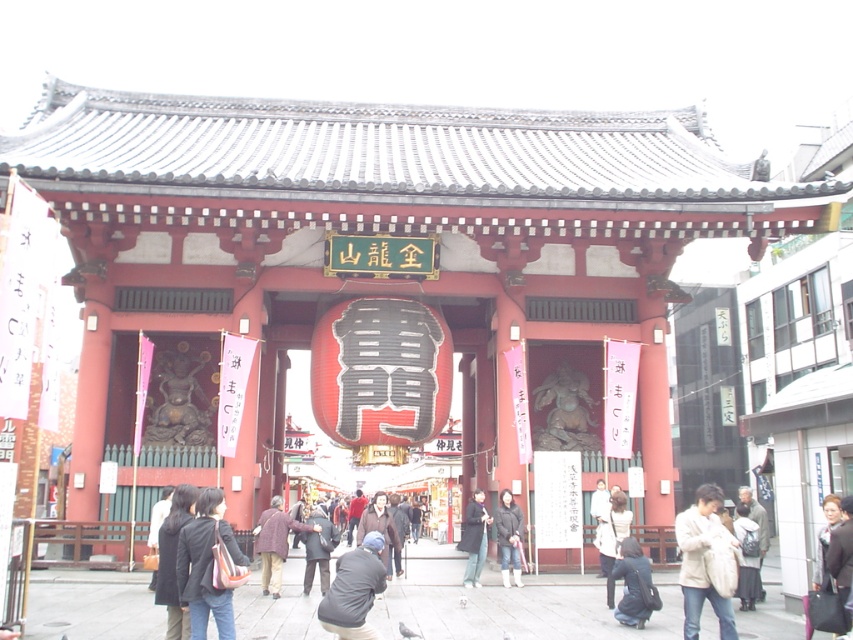
Question: Estimate the real-world distances between objects in this image. Which object is closer to the dark brown leather jacket at lower left?

Choices:
 (A) dark gray jacket at lower center
 (B) dark gray fabric coat at center

Answer: (A)

Question: Based on their relative distances, which object is farther from the dark gray jacket at lower center?

Choices:
 (A) white cotton jacket at lower center
 (B) dark blue leather jacket at lower center
 (C) light brown fabric bag at lower right
 (D) brown wool coat at center

Answer: (C)

Question: From the image, what is the correct spatial relationship of dark gray coat at lower left in relation to light brown fabric bag at lower right?

Choices:
 (A) below
 (B) above

Answer: (B)

Question: Does dark brown leather jacket at lower left have a larger size compared to white fur coat at lower right?

Choices:
 (A) no
 (B) yes

Answer: (A)

Question: Which point is closer to the camera taking this photo?

Choices:
 (A) (647, 566)
 (B) (196, 584)
 (C) (721, 630)
 (D) (375, 552)

Answer: (B)

Question: Does dark blue leather jacket at lower center have a greater width compared to white cotton jacket at lower center?

Choices:
 (A) no
 (B) yes

Answer: (B)